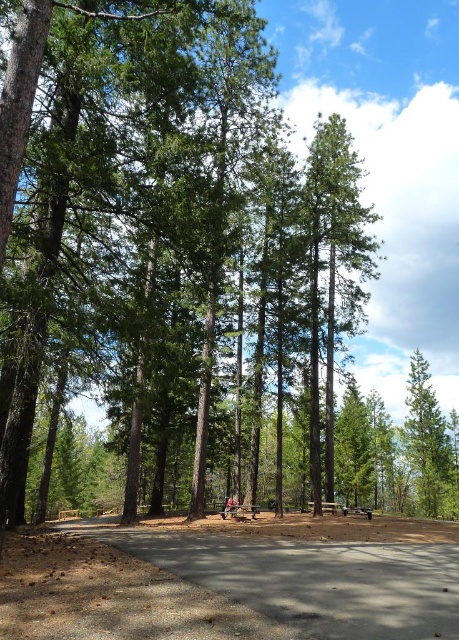
Is point (419, 387) less distant than point (341, 512)?

No.

Is green matte tree at right shorter than wooden park bench at center?

Incorrect, green matte tree at right's height does not fall short of wooden park bench at center's.

Find the location of a particular element. The width and height of the screenshot is (459, 640). green matte tree at right is located at coordinates (426, 440).

Can you confirm if green rough bark tree at center is shorter than wooden picnic table at center?

No, green rough bark tree at center is not shorter than wooden picnic table at center.

Is point (311, 461) positioned before point (247, 509)?

That is True.

Locate an element on the screen. green rough bark tree at center is located at coordinates (331, 266).

Consider the image. Does green rough bark tree at center appear on the left side of green matte tree at right?

Indeed, green rough bark tree at center is positioned on the left side of green matte tree at right.

Which is below, green rough bark tree at center or green matte tree at right?

Positioned lower is green matte tree at right.

Who is more distant from viewer, (x=334, y=308) or (x=414, y=465)?

The point (x=414, y=465) is behind.

I want to click on green rough bark tree at center, so click(331, 266).